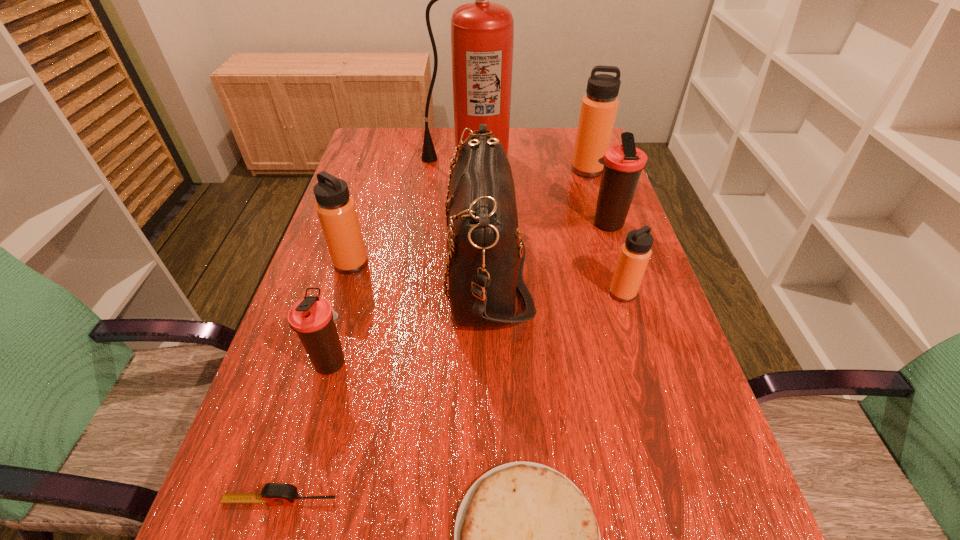
The height and width of the screenshot is (540, 960). Find the location of `free space located on the front of the bigger brown thermos bottle`. free space located on the front of the bigger brown thermos bottle is located at coordinates (650, 357).

Identify the location of free space located 0.330m on the front of the second nearest orange thermos bottle. The width and height of the screenshot is (960, 540). (308, 407).

At what (x,y) coordinates should I click in order to perform the action: click on free space located on the back of the nearer brown thermos bottle. Please return your answer as a coordinate pair (x, y). The height and width of the screenshot is (540, 960). Looking at the image, I should click on (371, 226).

At what (x,y) coordinates should I click in order to perform the action: click on free space located 0.390m on the front of the second nearest thermos bottle. Please return your answer as a coordinate pair (x, y). The height and width of the screenshot is (540, 960). Looking at the image, I should click on (684, 494).

At what (x,y) coordinates should I click in order to perform the action: click on vacant space located 0.340m on the right of the black tape measure. Please return your answer as a coordinate pair (x, y). The image size is (960, 540). Looking at the image, I should click on (562, 501).

What are the coordinates of `fire extinguisher present at the far edge` in the screenshot? It's located at (482, 33).

The image size is (960, 540). What are the coordinates of `thermos bottle that is at the far edge` in the screenshot? It's located at (599, 107).

At what (x,y) coordinates should I click in order to perform the action: click on tape measure that is at the left edge. Please return your answer as a coordinate pair (x, y). The height and width of the screenshot is (540, 960). Looking at the image, I should click on (274, 494).

I want to click on object at the far right corner, so click(x=599, y=107).

In the image, there is a desktop. Where is `free space at the far edge`? This screenshot has width=960, height=540. free space at the far edge is located at coordinates (513, 132).